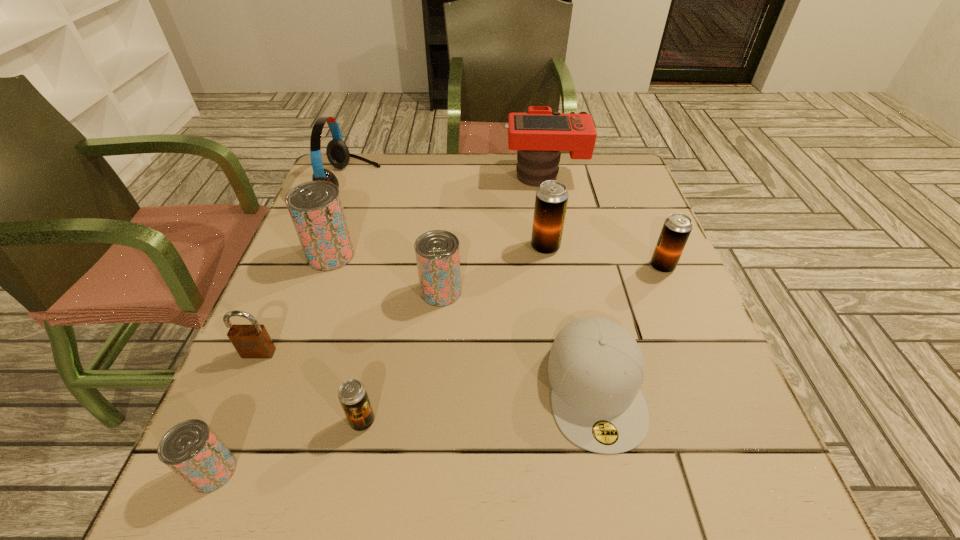
Locate an element on the screen. This screenshot has width=960, height=540. red headset is located at coordinates [337, 152].

Where is `camera`? camera is located at coordinates (539, 134).

Find the location of a particular element. This screenshot has width=960, height=540. the farthest black beer can is located at coordinates (551, 200).

This screenshot has width=960, height=540. Identify the location of the biggest black beer can. (551, 200).

At what (x,y) coordinates should I click in order to perform the action: click on the biggest red beer can. Please return your answer as a coordinate pair (x, y). The height and width of the screenshot is (540, 960). Looking at the image, I should click on (315, 207).

The image size is (960, 540). I want to click on the rightmost object, so click(x=676, y=229).

Locate an element on the screen. This screenshot has height=540, width=960. the second biggest black beer can is located at coordinates (676, 229).

Image resolution: width=960 pixels, height=540 pixels. What are the coordinates of `the sixth farthest object` in the screenshot? It's located at (437, 252).

At what (x,y) coordinates should I click in order to perform the action: click on the second farthest red beer can. Please return your answer as a coordinate pair (x, y). Looking at the image, I should click on (437, 252).

Identify the location of padlock. (250, 341).